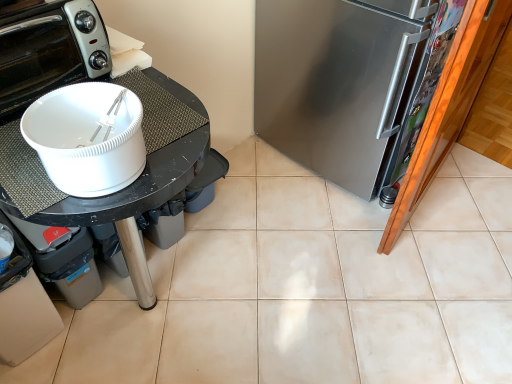
The image size is (512, 384). Find the location of `free point below black matte table at left (from a real-world perspective)`. free point below black matte table at left (from a real-world perspective) is located at coordinates (155, 309).